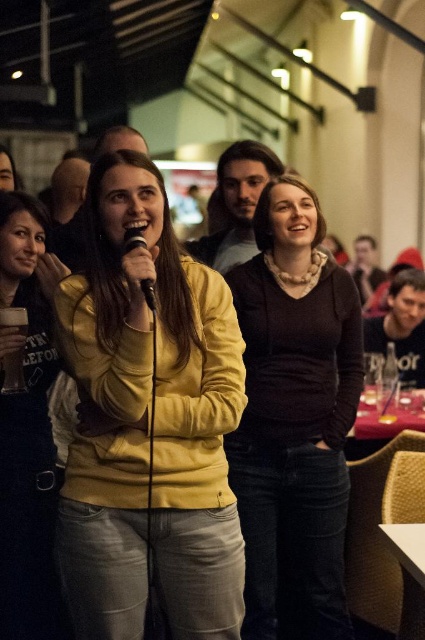
In the scene, there is a woman holding a microphone and a point marked at coordinates [235,204]. What is located at that point?

The point at [235,204] marks the location of the woman with smooth brown hair at center.

You are organizing a photo shoot and need to ensure that two models wearing the yellow matte jacket at center and the matte yellow sweater at center can stand side by side without overlapping. Based on the scene description, can they comfortably stand next to each other?

The yellow matte jacket at center might be wider than matte yellow sweater at center, so there might not be enough space for them to stand side by side comfortably without overlapping.